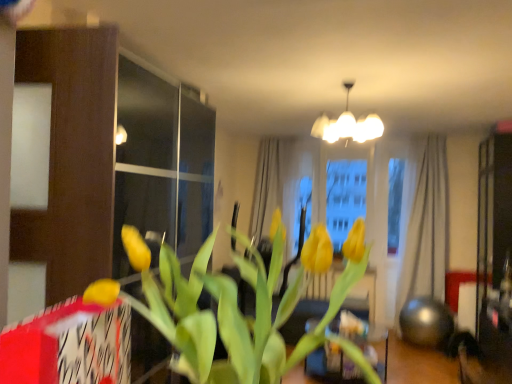
Describe the element at coordinates (348, 125) in the screenshot. I see `white glossy chandelier at upper center` at that location.

Where is `yellow matte tulip at center`? This screenshot has width=512, height=384. yellow matte tulip at center is located at coordinates (237, 307).

Where is `white glossy chandelier at upper center`? white glossy chandelier at upper center is located at coordinates (348, 125).

Is white glossy chandelier at upper center facing towards beige fabric curtain at right?

Yes, white glossy chandelier at upper center is turned towards beige fabric curtain at right.

In the image, is white glossy chandelier at upper center positioned in front of or behind beige fabric curtain at right?

white glossy chandelier at upper center is positioned closer to the viewer than beige fabric curtain at right.

Is white glossy chandelier at upper center outside of beige fabric curtain at right?

white glossy chandelier at upper center is positioned outside beige fabric curtain at right.

Between white glossy chandelier at upper center and beige fabric curtain at right, which one appears on the right side from the viewer's perspective?

Positioned to the right is beige fabric curtain at right.

Which of these two, yellow matte tulip at center or white glossy chandelier at upper center, is bigger?

white glossy chandelier at upper center is bigger.

Which point is more distant from viewer, (199, 378) or (343, 118)?

The point (343, 118) is farther.

Is yellow matte tulip at center not near white glossy chandelier at upper center?

Absolutely, yellow matte tulip at center is distant from white glossy chandelier at upper center.

From the image's perspective, relative to yellow matte tulip at center, is beige fabric curtain at right above or below?

beige fabric curtain at right is situated lower than yellow matte tulip at center in the image.

Can you see beige fabric curtain at right touching yellow matte tulip at center?

No.

Would you say beige fabric curtain at right contains yellow matte tulip at center?

No, yellow matte tulip at center is located outside of beige fabric curtain at right.

Visually, is beige fabric curtain at right positioned to the left or to the right of yellow matte tulip at center?

In the image, beige fabric curtain at right appears on the right side of yellow matte tulip at center.

Which is less distant, [424,239] or [347,133]?

The point [347,133] is more forward.

Does beige fabric curtain at right have a larger size compared to white glossy chandelier at upper center?

Correct, beige fabric curtain at right is larger in size than white glossy chandelier at upper center.

Where is `lamp above the beige fabric curtain at right (from a real-world perspective)`? This screenshot has height=384, width=512. lamp above the beige fabric curtain at right (from a real-world perspective) is located at coordinates [348, 125].

From a real-world perspective, between beige fabric curtain at right and white glossy chandelier at upper center, who is vertically higher?

white glossy chandelier at upper center, from a real-world perspective.

Between yellow matte tulip at center and beige fabric curtain at right, which one has larger width?

With larger width is yellow matte tulip at center.

Considering the relative sizes of yellow matte tulip at center and beige fabric curtain at right in the image provided, is yellow matte tulip at center taller than beige fabric curtain at right?

No, yellow matte tulip at center is not taller than beige fabric curtain at right.

Where is `curtain lying on the right of yellow matte tulip at center`? The height and width of the screenshot is (384, 512). curtain lying on the right of yellow matte tulip at center is located at coordinates (426, 249).

Between yellow matte tulip at center and beige fabric curtain at right, which one has larger size?

Bigger between the two is beige fabric curtain at right.

Does white glossy chandelier at upper center have a smaller size compared to yellow matte tulip at center?

No.

Choose the correct answer: Is white glossy chandelier at upper center inside yellow matte tulip at center or outside it?

The correct answer is: outside.

Considering the sizes of white glossy chandelier at upper center and yellow matte tulip at center in the image, is white glossy chandelier at upper center taller or shorter than yellow matte tulip at center?

Considering their sizes, white glossy chandelier at upper center has more height than yellow matte tulip at center.

Locate an element on the screen. The image size is (512, 384). curtain directly beneath the white glossy chandelier at upper center (from a real-world perspective) is located at coordinates (426, 249).

I want to click on lamp on the right of yellow matte tulip at center, so click(x=348, y=125).

Based on the photo, which object lies further to the anchor point white glossy chandelier at upper center, beige fabric curtain at right or yellow matte tulip at center?

yellow matte tulip at center lies further to white glossy chandelier at upper center than the other object.

When comparing their distances from yellow matte tulip at center, does beige fabric curtain at right or white glossy chandelier at upper center seem further?

beige fabric curtain at right lies further to yellow matte tulip at center than the other object.

From the image, which object appears to be farther from yellow matte tulip at center, white glossy chandelier at upper center or beige fabric curtain at right?

beige fabric curtain at right is further to yellow matte tulip at center.

When comparing their distances from white glossy chandelier at upper center, does yellow matte tulip at center or beige fabric curtain at right seem closer?

beige fabric curtain at right is closer to white glossy chandelier at upper center.

Considering their positions, is white glossy chandelier at upper center positioned further to beige fabric curtain at right than yellow matte tulip at center?

Among the two, yellow matte tulip at center is located further to beige fabric curtain at right.

When comparing their distances from beige fabric curtain at right, does yellow matte tulip at center or white glossy chandelier at upper center seem closer?

Based on the image, white glossy chandelier at upper center appears to be nearer to beige fabric curtain at right.

You are a GUI agent. You are given a task and a screenshot of the screen. Output one action in this format:
    pyautogui.click(x=<x>, y=<y>)
    Task: Click on the lamp located between yellow matte tulip at center and beige fabric curtain at right in the depth direction
    The width and height of the screenshot is (512, 384).
    Given the screenshot: What is the action you would take?
    pyautogui.click(x=348, y=125)